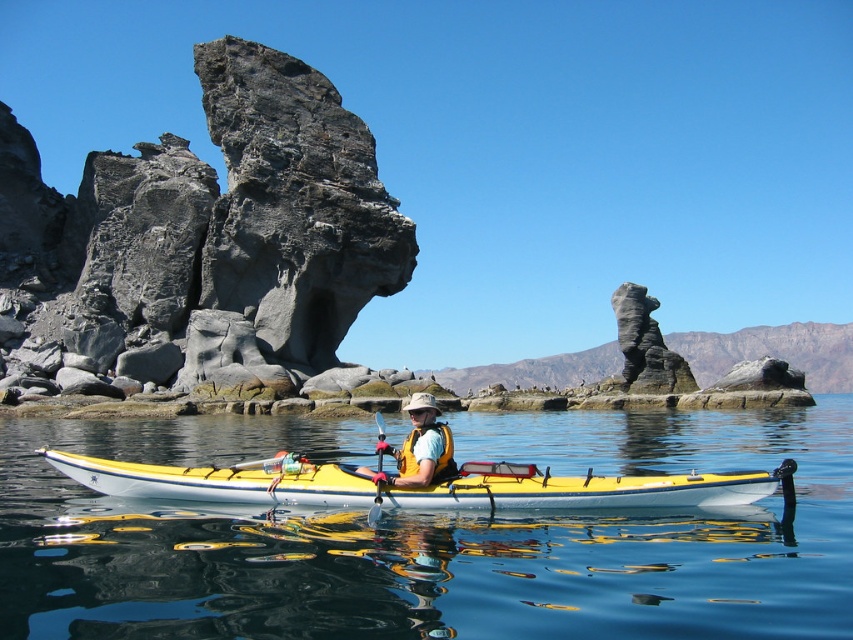
Can you confirm if dark gray stone rock formation at upper left is wider than yellow life vest at center?

Yes.

From the picture: Between dark gray stone rock formation at upper left and yellow life vest at center, which one appears on the left side from the viewer's perspective?

dark gray stone rock formation at upper left is more to the left.

I want to click on dark gray stone rock formation at upper left, so click(206, 236).

Find the location of `transparent blue water at center`. transparent blue water at center is located at coordinates (433, 536).

The height and width of the screenshot is (640, 853). I want to click on transparent blue water at center, so tap(433, 536).

At what (x,y) coordinates should I click in order to perform the action: click on transparent blue water at center. Please return your answer as a coordinate pair (x, y). The image size is (853, 640). Looking at the image, I should click on (433, 536).

Is point (434, 404) behind point (379, 506)?

Yes, it is.

Which is in front, point (426, 396) or point (378, 429)?

Point (426, 396)

Which is behind, point (416, 444) or point (372, 515)?

The point (416, 444) is behind.

Find the location of a particular element. The image size is (853, 640). yellow life vest at center is located at coordinates point(421,448).